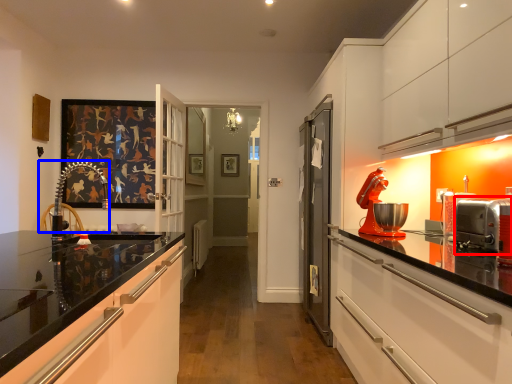
Question: Which object is further to the camera taking this photo, appliance (highlighted by a red box) or chair (highlighted by a blue box)?

Choices:
 (A) appliance
 (B) chair

Answer: (B)